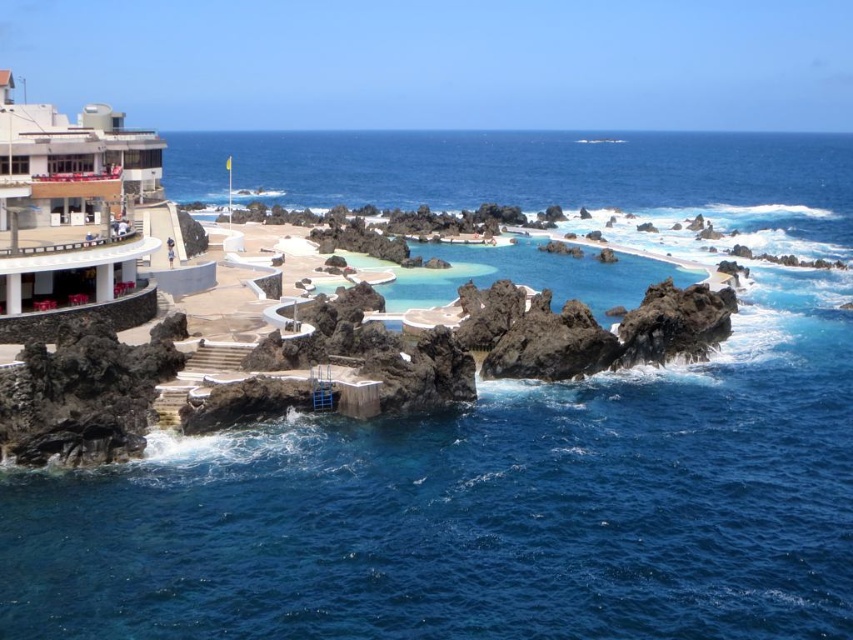
Is white concrete building at upper left further to camera compared to clear glass pool at center?

No.

Between white concrete building at upper left and clear glass pool at center, which one is positioned higher?

Positioned higher is white concrete building at upper left.

Is point (55, 212) farther from camera compared to point (451, 269)?

That is False.

Locate an element on the screen. This screenshot has height=640, width=853. white concrete building at upper left is located at coordinates (71, 163).